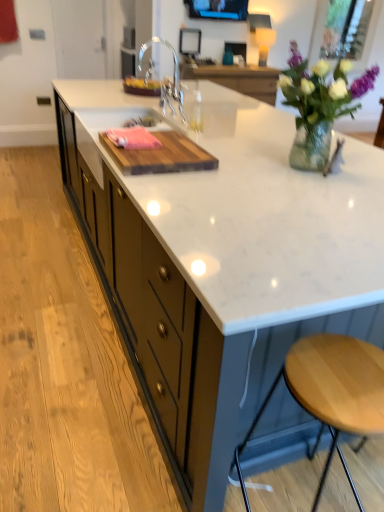
Locate an element on the screen. This screenshot has width=384, height=512. matte black tv at upper center, acting as the 1th window screen starting from the front is located at coordinates (218, 9).

The width and height of the screenshot is (384, 512). Describe the element at coordinates (337, 387) in the screenshot. I see `light brown wood stool at lower right` at that location.

Where is `matte black tv at upper center, which appears as the second window screen when viewed from the back`? This screenshot has width=384, height=512. matte black tv at upper center, which appears as the second window screen when viewed from the back is located at coordinates (218, 9).

Can you confirm if clear glass vase at upper right is shorter than wooden cutting board at center?

No, clear glass vase at upper right is not shorter than wooden cutting board at center.

From the image's perspective, would you say clear glass vase at upper right is shown under wooden cutting board at center?

Incorrect, from the image's perspective, clear glass vase at upper right is higher than wooden cutting board at center.

From a real-world perspective, is clear glass vase at upper right located higher than wooden cutting board at center?

Indeed, from a real-world perspective, clear glass vase at upper right stands above wooden cutting board at center.

Could you tell me if matte black tv at upper center, acting as the 1th window screen starting from the front, is turned towards clear glass window screen at upper right, marked as the second window screen in a left-to-right arrangement?

No, matte black tv at upper center, acting as the 1th window screen starting from the front, is not turned towards clear glass window screen at upper right, marked as the second window screen in a left-to-right arrangement.

Considering the relative sizes of matte black tv at upper center, arranged as the second window screen when viewed from the right, and clear glass window screen at upper right, marked as the first window screen in a right-to-left arrangement, in the image provided, is matte black tv at upper center, arranged as the second window screen when viewed from the right, smaller than clear glass window screen at upper right, marked as the first window screen in a right-to-left arrangement,?

Yes, matte black tv at upper center, arranged as the second window screen when viewed from the right, is smaller than clear glass window screen at upper right, marked as the first window screen in a right-to-left arrangement.

At what (x,y) coordinates should I click in order to perform the action: click on window screen that is above the clear glass window screen at upper right, the second window screen from the front (from a real-world perspective). Please return your answer as a coordinate pair (x, y). Looking at the image, I should click on (218, 9).

From the image's perspective, between matte black tv at upper center, positioned as the first window screen in left-to-right order, and clear glass window screen at upper right, marked as the second window screen in a left-to-right arrangement, which one is located above?

From the image's view, clear glass window screen at upper right, marked as the second window screen in a left-to-right arrangement, is above.

Who is more distant, wooden cutting board at center or chrome metallic faucet at center?

Positioned behind is chrome metallic faucet at center.

Can we say wooden cutting board at center lies outside chrome metallic faucet at center?

wooden cutting board at center is positioned outside chrome metallic faucet at center.

Which is more to the left, wooden cutting board at center or chrome metallic faucet at center?

chrome metallic faucet at center.

Does wooden cutting board at center have a greater width compared to chrome metallic faucet at center?

Correct, the width of wooden cutting board at center exceeds that of chrome metallic faucet at center.

Is matte black tv at upper center, which appears as the second window screen when viewed from the back, aimed at wooden cutting board at center?

Yes, matte black tv at upper center, which appears as the second window screen when viewed from the back, is aimed at wooden cutting board at center.

From a real-world perspective, which object stands above the other?

matte black tv at upper center, acting as the 1th window screen starting from the front, is physically above.

Who is taller, matte black tv at upper center, which appears as the second window screen when viewed from the back, or wooden cutting board at center?

matte black tv at upper center, which appears as the second window screen when viewed from the back, is taller.

Considering the relative positions of matte black tv at upper center, arranged as the second window screen when viewed from the right, and wooden cutting board at center in the image provided, is matte black tv at upper center, arranged as the second window screen when viewed from the right, to the left or to the right of wooden cutting board at center?

In the image, matte black tv at upper center, arranged as the second window screen when viewed from the right, appears on the right side of wooden cutting board at center.

Can you confirm if light brown wood stool at lower right is positioned to the left of matte black tv at upper center, which appears as the second window screen when viewed from the back?

Incorrect, light brown wood stool at lower right is not on the left side of matte black tv at upper center, which appears as the second window screen when viewed from the back.

Does light brown wood stool at lower right touch matte black tv at upper center, arranged as the second window screen when viewed from the right?

No, light brown wood stool at lower right is not with matte black tv at upper center, arranged as the second window screen when viewed from the right.

Consider the image. Is light brown wood stool at lower right wider than matte black tv at upper center, positioned as the first window screen in left-to-right order?

Yes.

Is light brown wood stool at lower right facing towards matte black tv at upper center, which appears as the second window screen when viewed from the back?

No, light brown wood stool at lower right is not facing towards matte black tv at upper center, which appears as the second window screen when viewed from the back.

Considering the relative sizes of light brown wood stool at lower right and white marble countertop at center in the image provided, is light brown wood stool at lower right shorter than white marble countertop at center?

Yes, light brown wood stool at lower right is shorter than white marble countertop at center.

Is light brown wood stool at lower right further to camera compared to white marble countertop at center?

No, light brown wood stool at lower right is closer to the viewer.

Considering the positions of objects light brown wood stool at lower right and white marble countertop at center in the image provided, who is more to the right, light brown wood stool at lower right or white marble countertop at center?

light brown wood stool at lower right.

From a real-world perspective, is light brown wood stool at lower right over white marble countertop at center?

No.

Is matte black tv at upper center, acting as the 1th window screen starting from the front, not within chrome metallic faucet at center?

Absolutely, matte black tv at upper center, acting as the 1th window screen starting from the front, is external to chrome metallic faucet at center.

Is point (233, 1) farther from viewer compared to point (186, 120)?

Yes, it is behind point (186, 120).

Could you tell me if matte black tv at upper center, acting as the 1th window screen starting from the front, is turned towards chrome metallic faucet at center?

Yes, matte black tv at upper center, acting as the 1th window screen starting from the front, faces towards chrome metallic faucet at center.

Image resolution: width=384 pixels, height=512 pixels. Find the location of `plank below the clear glass vase at upper right (from the image's perspective)`. plank below the clear glass vase at upper right (from the image's perspective) is located at coordinates 161,155.

Find the location of a particular element. window screen above the matte black tv at upper center, acting as the 1th window screen starting from the front (from the image's perspective) is located at coordinates (346, 28).

Based on their spatial positions, is clear glass window screen at upper right, the second window screen from the front, or chrome metallic faucet at center closer to white marble countertop at center?

chrome metallic faucet at center is positioned closer to the anchor white marble countertop at center.

From the image, which object appears to be nearer to white marble countertop at center, clear glass window screen at upper right, the second window screen from the front, or light brown wood stool at lower right?

Based on the image, light brown wood stool at lower right appears to be nearer to white marble countertop at center.

In the scene shown: Looking at the image, which one is located closer to light brown wood stool at lower right, matte black tv at upper center, which appears as the second window screen when viewed from the back, or clear glass window screen at upper right, marked as the second window screen in a left-to-right arrangement?

Based on the image, clear glass window screen at upper right, marked as the second window screen in a left-to-right arrangement, appears to be nearer to light brown wood stool at lower right.

Looking at the image, which one is located further to clear glass vase at upper right, light brown wood stool at lower right or matte black tv at upper center, positioned as the first window screen in left-to-right order?

matte black tv at upper center, positioned as the first window screen in left-to-right order, is further to clear glass vase at upper right.

Looking at the image, which one is located further to chrome metallic faucet at center, matte black tv at upper center, positioned as the first window screen in left-to-right order, or wooden cutting board at center?

matte black tv at upper center, positioned as the first window screen in left-to-right order, is positioned further to the anchor chrome metallic faucet at center.

Looking at the image, which one is located closer to light brown wood stool at lower right, chrome metallic faucet at center or clear glass window screen at upper right, the second window screen from the front?

Among the two, chrome metallic faucet at center is located nearer to light brown wood stool at lower right.

Based on their spatial positions, is light brown wood stool at lower right or clear glass vase at upper right closer to matte black tv at upper center, which appears as the second window screen when viewed from the back?

The object closer to matte black tv at upper center, which appears as the second window screen when viewed from the back, is clear glass vase at upper right.

When comparing their distances from wooden cutting board at center, does chrome metallic faucet at center or matte black tv at upper center, which appears as the second window screen when viewed from the back, seem closer?

The object closer to wooden cutting board at center is chrome metallic faucet at center.

You are a GUI agent. You are given a task and a screenshot of the screen. Output one action in this format:
    pyautogui.click(x=<x>, y=<y>)
    Task: Click on the floral arrangement located between light brown wood stool at lower right and matte black tv at upper center, which appears as the second window screen when viewed from the back, in the depth direction
    
    Given the screenshot: What is the action you would take?
    pyautogui.click(x=319, y=104)

Where is `plank between light brown wood stool at lower right and clear glass window screen at upper right, the second window screen from the front, from front to back`? This screenshot has height=512, width=384. plank between light brown wood stool at lower right and clear glass window screen at upper right, the second window screen from the front, from front to back is located at coordinates (161, 155).

Identify the location of plank that lies between chrome metallic faucet at center and light brown wood stool at lower right from top to bottom. The image size is (384, 512). (161, 155).

I want to click on window screen between chrome metallic faucet at center and clear glass window screen at upper right, the second window screen from the front, along the z-axis, so click(x=218, y=9).